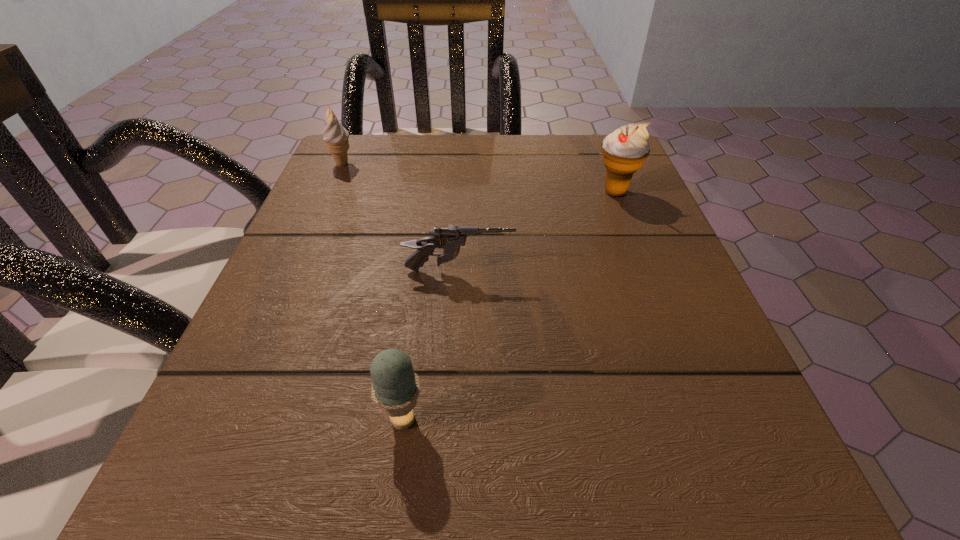
The width and height of the screenshot is (960, 540). Find the location of `vacant space in between the second ice cream from right to left and the gun`. vacant space in between the second ice cream from right to left and the gun is located at coordinates (431, 345).

I want to click on vacant area that lies between the tallest ice cream and the leftmost ice cream, so click(478, 178).

You are a GUI agent. You are given a task and a screenshot of the screen. Output one action in this format:
    pyautogui.click(x=<x>, y=<y>)
    Task: Click on the free spot between the nearest ice cream and the farthest object
    This screenshot has width=960, height=540.
    Given the screenshot: What is the action you would take?
    pyautogui.click(x=372, y=292)

The image size is (960, 540). Find the location of `object that is the third closest to the gun`. object that is the third closest to the gun is located at coordinates (335, 136).

Select which object is the third closest to the rightmost ice cream. Please provide its 2D coordinates. Your answer should be formatted as a tuple, i.e. [(x, y)], where the tuple contains the x and y coordinates of a point satisfying the conditions above.

[(395, 388)]

In order to click on the closest ice cream to the second ice cream from left to right in this screenshot , I will do `click(624, 151)`.

Select which ice cream appears as the closest to the rightmost ice cream. Please provide its 2D coordinates. Your answer should be formatted as a tuple, i.e. [(x, y)], where the tuple contains the x and y coordinates of a point satisfying the conditions above.

[(335, 136)]

The width and height of the screenshot is (960, 540). I want to click on vacant area that satisfies the following two spatial constraints: 1. on the front-facing side of the leftmost ice cream; 2. on the back side of the rightmost ice cream, so click(329, 192).

The height and width of the screenshot is (540, 960). Find the location of `free space that satisfies the following two spatial constraints: 1. on the back side of the rightmost object; 2. on the front-facing side of the farthest ice cream`. free space that satisfies the following two spatial constraints: 1. on the back side of the rightmost object; 2. on the front-facing side of the farthest ice cream is located at coordinates point(604,164).

Where is `vacant space that satisfies the following two spatial constraints: 1. on the front-facing side of the farthest object; 2. on the left side of the second ice cream from right to left`? This screenshot has width=960, height=540. vacant space that satisfies the following two spatial constraints: 1. on the front-facing side of the farthest object; 2. on the left side of the second ice cream from right to left is located at coordinates (229, 419).